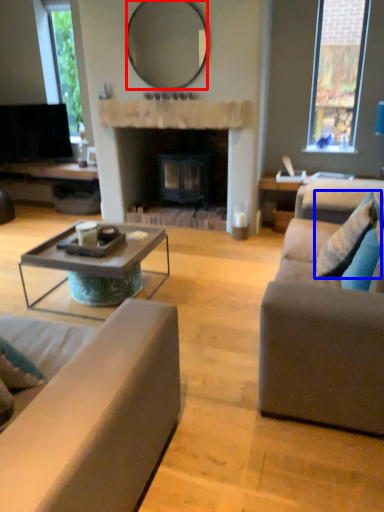
Question: Among these objects, which one is nearest to the camera, mirror (highlighted by a red box) or pillow (highlighted by a blue box)?

Choices:
 (A) mirror
 (B) pillow

Answer: (B)